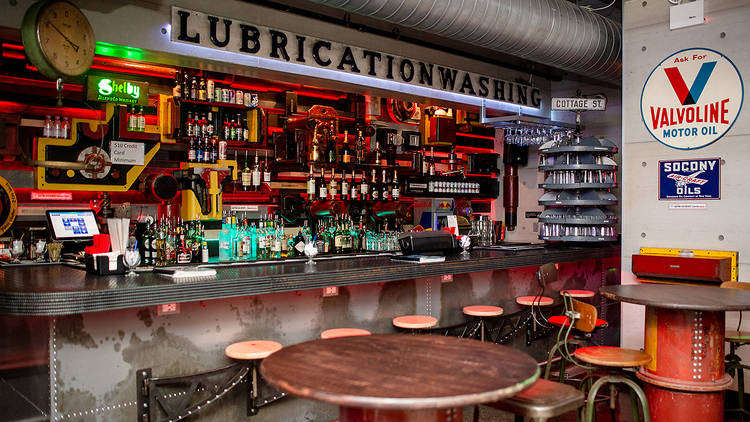
In order to click on wooden circle table in this screenshot , I will do `click(439, 382)`, `click(669, 302)`.